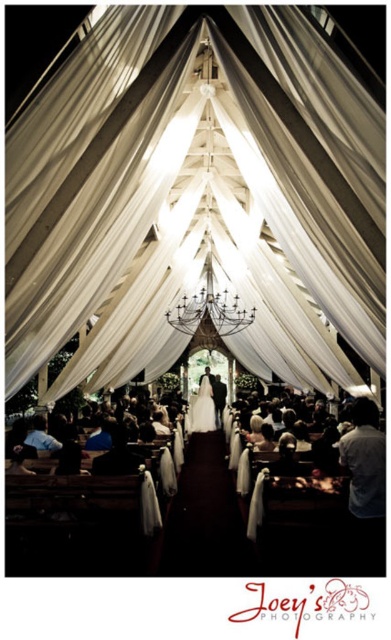
Question: Among these objects, which one is farthest from the camera?

Choices:
 (A) white satin aisle at center
 (B) gray fabric at right
 (C) black wrought iron chandelier at center
 (D) white satin dress at center

Answer: (C)

Question: Which object is farther from the camera taking this photo?

Choices:
 (A) white sheer fabric at center
 (B) black wrought iron chandelier at center
 (C) gray fabric at right
 (D) white satin dress at center

Answer: (B)

Question: Is white sheer fabric at center smaller than white satin aisle at center?

Choices:
 (A) yes
 (B) no

Answer: (B)

Question: From the image, what is the correct spatial relationship of white sheer fabric at center in relation to white satin dress at center?

Choices:
 (A) right
 (B) left

Answer: (A)

Question: Is the position of black wrought iron chandelier at center more distant than that of white satin dress at center?

Choices:
 (A) no
 (B) yes

Answer: (B)

Question: Considering the real-world distances, which object is farthest from the black wrought iron chandelier at center?

Choices:
 (A) white satin dress at center
 (B) white sheer fabric at center
 (C) gray fabric at right
 (D) white satin aisle at center

Answer: (C)